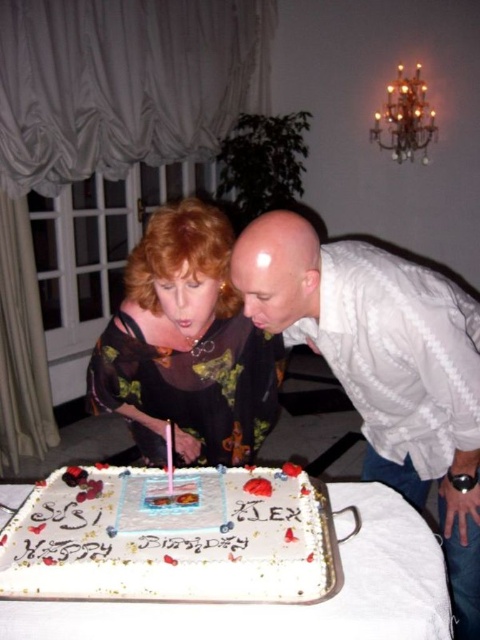
Is matte black dress at center to the right of white cardboard cake at center from the viewer's perspective?

In fact, matte black dress at center is to the left of white cardboard cake at center.

Does matte black dress at center appear on the left side of white cardboard cake at center?

Indeed, matte black dress at center is positioned on the left side of white cardboard cake at center.

At what (x,y) coordinates should I click in order to perform the action: click on matte black dress at center. Please return your answer as a coordinate pair (x, y). Image resolution: width=480 pixels, height=640 pixels. Looking at the image, I should click on (189, 348).

The width and height of the screenshot is (480, 640). Identify the location of matte black dress at center. (189, 348).

Is point (415, 416) farther from viewer compared to point (272, 340)?

No, (415, 416) is closer to viewer.

Can you confirm if white textured shirt at center is positioned to the right of matte black dress at center?

Correct, you'll find white textured shirt at center to the right of matte black dress at center.

Is point (355, 289) positioned after point (152, 349)?

No, it is not.

The height and width of the screenshot is (640, 480). I want to click on white textured shirt at center, so click(384, 368).

Is point (164, 380) positioned behind point (169, 493)?

Yes.

Can you confirm if matte black dress at center is wider than pink wax candle at center?

Correct, the width of matte black dress at center exceeds that of pink wax candle at center.

At what (x,y) coordinates should I click in order to perform the action: click on matte black dress at center. Please return your answer as a coordinate pair (x, y). The width and height of the screenshot is (480, 640). Looking at the image, I should click on (189, 348).

You are a GUI agent. You are given a task and a screenshot of the screen. Output one action in this format:
    pyautogui.click(x=<x>, y=<y>)
    Task: Click on the matte black dress at center
    The height and width of the screenshot is (640, 480).
    Given the screenshot: What is the action you would take?
    pyautogui.click(x=189, y=348)